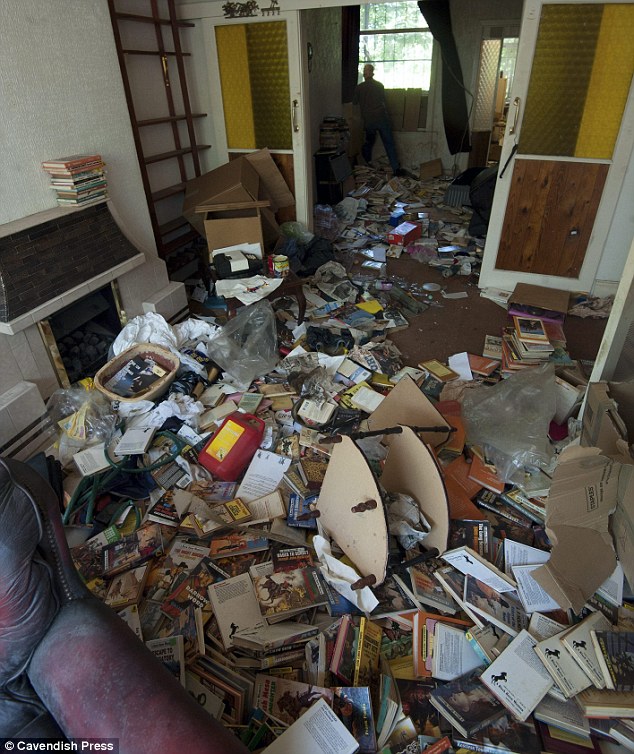
The width and height of the screenshot is (634, 754). In order to click on door in this screenshot , I will do `click(507, 65)`.